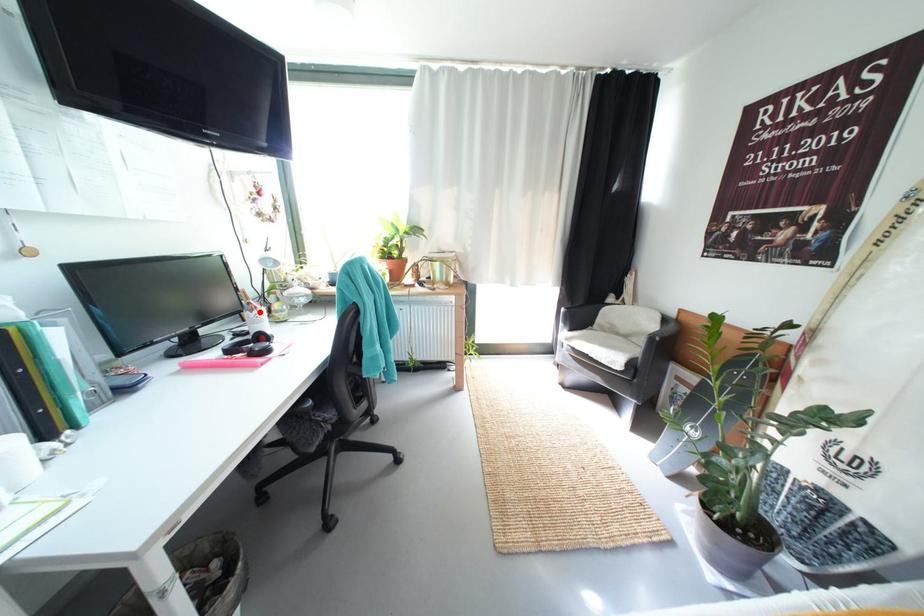
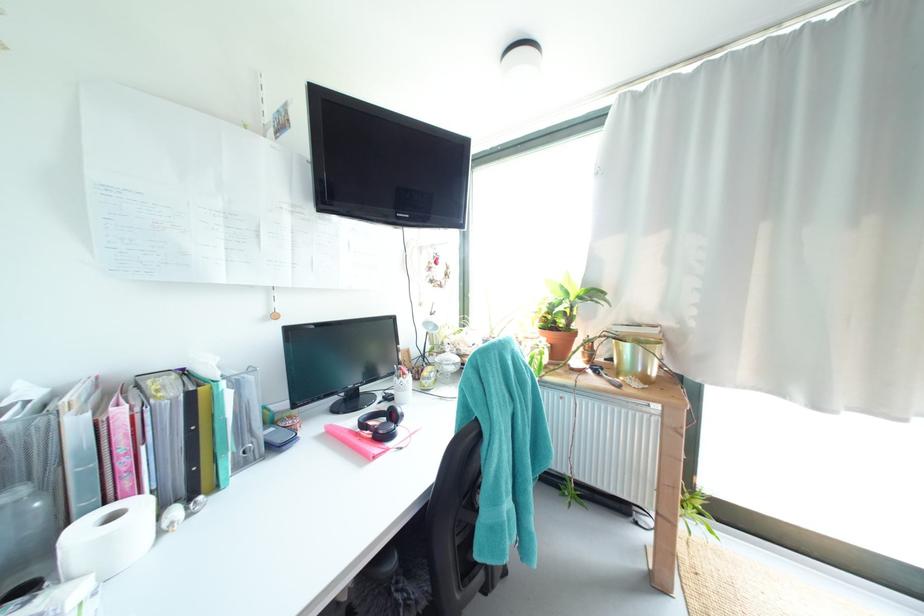
In the second image, find the point that corresponds to the highlighted location in the first image.

(407, 379)